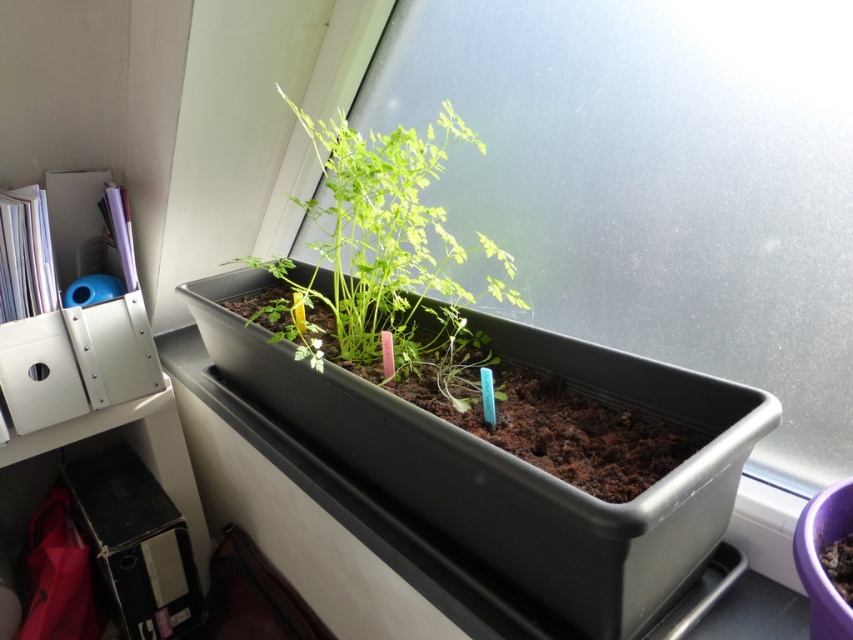
You are standing in front of the windowsill with the rectangular black plastic planter box. There is a point marked at coordinates (x=473, y=481). Based on the scene description, what does this point likely represent?

The point at coordinates (x=473, y=481) marks the black plastic tray at center.

You are a gardener who needs to water the green matte plant at center. The black plastic tray at center is currently empty. Where should you pour water to ensure the plant gets enough moisture without overwatering?

You should pour water directly onto the soil around the green matte plant at center. Since the black plastic tray at center is larger, it can collect excess water, preventing overwatering while allowing the plant to absorb what it needs.

You are a gardener who wants to ensure proper sunlight for the green matte plant at center. Since the black plastic tray at center is blocking some light, can you determine if the plant is taller than the tray to receive more sunlight?

The black plastic tray at center has a greater height compared to green matte plant at center, so the tray is taller than the plant, which means it might block sunlight from reaching the plant.